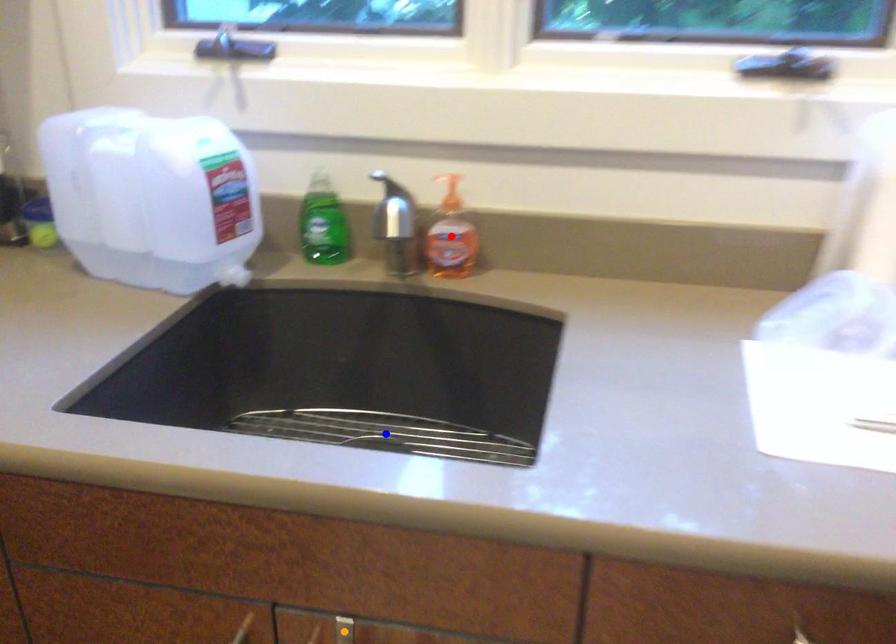
Order these from nearest to farthest:
orange point, blue point, red point

1. orange point
2. red point
3. blue point